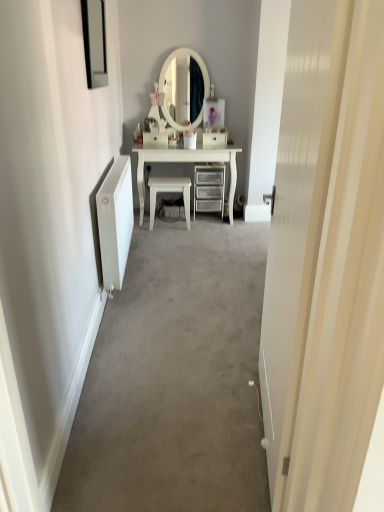
Image resolution: width=384 pixels, height=512 pixels. I want to click on white glossy chair at center, so click(x=170, y=192).

The image size is (384, 512). I want to click on white glossy drawer at center, the 1th drawer viewed from the left, so [155, 138].

Locate an element on the screen. black glass picture frame at upper left is located at coordinates (94, 42).

What do you see at coordinates (325, 258) in the screenshot? This screenshot has width=384, height=512. I see `white wood door at center` at bounding box center [325, 258].

The image size is (384, 512). Describe the element at coordinates (215, 138) in the screenshot. I see `white glossy drawer at center, which appears as the first drawer when viewed from the right` at that location.

You are a GUI agent. You are given a task and a screenshot of the screen. Output one action in this format:
    pyautogui.click(x=<x>, y=<y>)
    Task: Click on the white glossy chair at center
    
    Given the screenshot: What is the action you would take?
    pyautogui.click(x=170, y=192)

From a real-world perspective, is white wood door at center over white glossy drawer at center, the 1th drawer viewed from the left?

Yes, from a real-world perspective, white wood door at center is over white glossy drawer at center, the 1th drawer viewed from the left

Can you confirm if white wood door at center is wider than white glossy drawer at center, the 1th drawer viewed from the left?

In fact, white wood door at center might be narrower than white glossy drawer at center, the 1th drawer viewed from the left.

Based on the photo, from the image's perspective, between white wood door at center and white glossy drawer at center, acting as the second drawer starting from the right, who is located below?

white wood door at center, from the image's perspective.

Is white wood door at center inside the boundaries of white glossy drawer at center, the 1th drawer viewed from the left, or outside?

white wood door at center is outside white glossy drawer at center, the 1th drawer viewed from the left.

Is white wood door at center surrounding white glossy chair at center?

Actually, white glossy chair at center is outside white wood door at center.

Looking at the image, does white wood door at center seem bigger or smaller compared to white glossy chair at center?

In the image, white wood door at center appears to be larger than white glossy chair at center.

Can you tell me how much white wood door at center and white glossy chair at center differ in facing direction?

The angle between the facing direction of white wood door at center and the facing direction of white glossy chair at center is 83.8 degrees.

Considering the positions of objects white wood door at center and white glossy chair at center in the image provided, who is more to the right, white wood door at center or white glossy chair at center?

Positioned to the right is white wood door at center.

Is black glass picture frame at upper left beside white glossy drawer at center, acting as the second drawer starting from the right?

No, black glass picture frame at upper left is not beside white glossy drawer at center, acting as the second drawer starting from the right.

Looking at this image, in terms of height, does black glass picture frame at upper left look taller or shorter compared to white glossy drawer at center, the 1th drawer viewed from the left?

black glass picture frame at upper left is taller than white glossy drawer at center, the 1th drawer viewed from the left.

Starting from the black glass picture frame at upper left, which drawer is the 1st one behind? Please provide its 2D coordinates.

[(155, 138)]

Based on the photo, would you say black glass picture frame at upper left is outside white glossy drawer at center, the 1th drawer viewed from the left?

black glass picture frame at upper left is positioned outside white glossy drawer at center, the 1th drawer viewed from the left.

Consider the image. Which is nearer, (x=211, y=172) or (x=150, y=133)?

Point (x=211, y=172) is farther from the camera than point (x=150, y=133).

From a real-world perspective, which object rests below the other?

metallic silver chest of drawers at center is physically lower.

How many degrees apart are the facing directions of metallic silver chest of drawers at center and white glossy drawer at center, acting as the second drawer starting from the right?

The angular difference between metallic silver chest of drawers at center and white glossy drawer at center, acting as the second drawer starting from the right, is 0.879 degrees.

Who is more distant, metallic silver chest of drawers at center or white glossy drawer at center, acting as the second drawer starting from the right?

Positioned behind is white glossy drawer at center, acting as the second drawer starting from the right.

From a real-world perspective, is white glossy drawer at center, the 2th drawer viewed from the left, on metallic silver chest of drawers at center?

Yes, from a real-world perspective, white glossy drawer at center, the 2th drawer viewed from the left, is on top of metallic silver chest of drawers at center.

Considering the sizes of white glossy drawer at center, which appears as the first drawer when viewed from the right, and metallic silver chest of drawers at center in the image, is white glossy drawer at center, which appears as the first drawer when viewed from the right, wider or thinner than metallic silver chest of drawers at center?

white glossy drawer at center, which appears as the first drawer when viewed from the right, is thinner than metallic silver chest of drawers at center.

Considering the points (223, 141) and (200, 172), which point is in front, point (223, 141) or point (200, 172)?

The point (200, 172) is closer.

Which is more to the right, white glossy drawer at center, the 2th drawer viewed from the left, or metallic silver chest of drawers at center?

From the viewer's perspective, white glossy drawer at center, the 2th drawer viewed from the left, appears more on the right side.

Is white glossy drawer at center, the 2th drawer viewed from the left, in contact with white glossy chair at center?

No, white glossy drawer at center, the 2th drawer viewed from the left, is not with white glossy chair at center.

Measure the distance between white glossy drawer at center, the 2th drawer viewed from the left, and white glossy chair at center.

white glossy drawer at center, the 2th drawer viewed from the left, is 23.22 inches away from white glossy chair at center.

From the white glossy chair at center, count 2nd drawers backward and point to it. Please provide its 2D coordinates.

[(215, 138)]

Looking at this image, from the image's perspective, would you say white glossy drawer at center, the 2th drawer viewed from the left, is positioned over white glossy chair at center?

Yes, from the image's perspective, white glossy drawer at center, the 2th drawer viewed from the left, is over white glossy chair at center.

Between white glossy drawer at center, acting as the second drawer starting from the right, and metallic silver chest of drawers at center, which one has less height?

white glossy drawer at center, acting as the second drawer starting from the right.

This screenshot has height=512, width=384. Identify the location of the 1st drawer behind the metallic silver chest of drawers at center. (155, 138).

From a real-world perspective, is white glossy drawer at center, the 1th drawer viewed from the left, above or below metallic silver chest of drawers at center?

From a real-world perspective, white glossy drawer at center, the 1th drawer viewed from the left, is physically above metallic silver chest of drawers at center.

You are a GUI agent. You are given a task and a screenshot of the screen. Output one action in this format:
    pyautogui.click(x=<x>, y=<y>)
    Task: Click on the door above the white glossy drawer at center, acting as the second drawer starting from the right (from a real-world perspective)
    This screenshot has width=384, height=512.
    Given the screenshot: What is the action you would take?
    pyautogui.click(x=325, y=258)

Where is `chair directly beneath the white wood door at center (from a real-world perspective)`? Image resolution: width=384 pixels, height=512 pixels. chair directly beneath the white wood door at center (from a real-world perspective) is located at coordinates (170, 192).

Considering their positions, is white glossy drawer at center, the 1th drawer viewed from the left, positioned further to white glossy chair at center than white glossy drawer at center, which appears as the first drawer when viewed from the right?

The object further to white glossy chair at center is white glossy drawer at center, which appears as the first drawer when viewed from the right.

When comparing their distances from white glossy drawer at center, acting as the second drawer starting from the right, does white wood door at center or metallic silver chest of drawers at center seem further?

white wood door at center is positioned further to the anchor white glossy drawer at center, acting as the second drawer starting from the right.

Looking at this image, from the image, which object appears to be nearer to metallic silver chest of drawers at center, white wood door at center or white glossy drawer at center, acting as the second drawer starting from the right?

white glossy drawer at center, acting as the second drawer starting from the right, is positioned closer to the anchor metallic silver chest of drawers at center.

Consider the image. Looking at the image, which one is located further to black glass picture frame at upper left, white glossy drawer at center, the 2th drawer viewed from the left, or white glossy chair at center?

The object further to black glass picture frame at upper left is white glossy drawer at center, the 2th drawer viewed from the left.

Looking at the image, which one is located closer to white glossy chair at center, white glossy drawer at center, the 2th drawer viewed from the left, or metallic silver chest of drawers at center?

metallic silver chest of drawers at center is closer to white glossy chair at center.

From the image, which object appears to be farther from white wood door at center, white glossy drawer at center, the 1th drawer viewed from the left, or black glass picture frame at upper left?

white glossy drawer at center, the 1th drawer viewed from the left.

Consider the image. Which object lies further to the anchor point black glass picture frame at upper left, white glossy chair at center or metallic silver chest of drawers at center?

Based on the image, metallic silver chest of drawers at center appears to be further to black glass picture frame at upper left.

Looking at the image, which one is located further to white glossy chair at center, white wood door at center or black glass picture frame at upper left?

white wood door at center.

Locate an element on the screen. The width and height of the screenshot is (384, 512). picture frame located between white wood door at center and metallic silver chest of drawers at center in the depth direction is located at coordinates (94, 42).

Image resolution: width=384 pixels, height=512 pixels. I want to click on chair located between white wood door at center and white glossy drawer at center, the 2th drawer viewed from the left, in the depth direction, so click(x=170, y=192).

The width and height of the screenshot is (384, 512). What are the coordinates of `picture frame located between white wood door at center and white glossy drawer at center, the 1th drawer viewed from the left, in the depth direction` in the screenshot? It's located at (94, 42).

The width and height of the screenshot is (384, 512). I want to click on chest of drawers between white glossy drawer at center, acting as the second drawer starting from the right, and white glossy drawer at center, which appears as the first drawer when viewed from the right, so (209, 188).